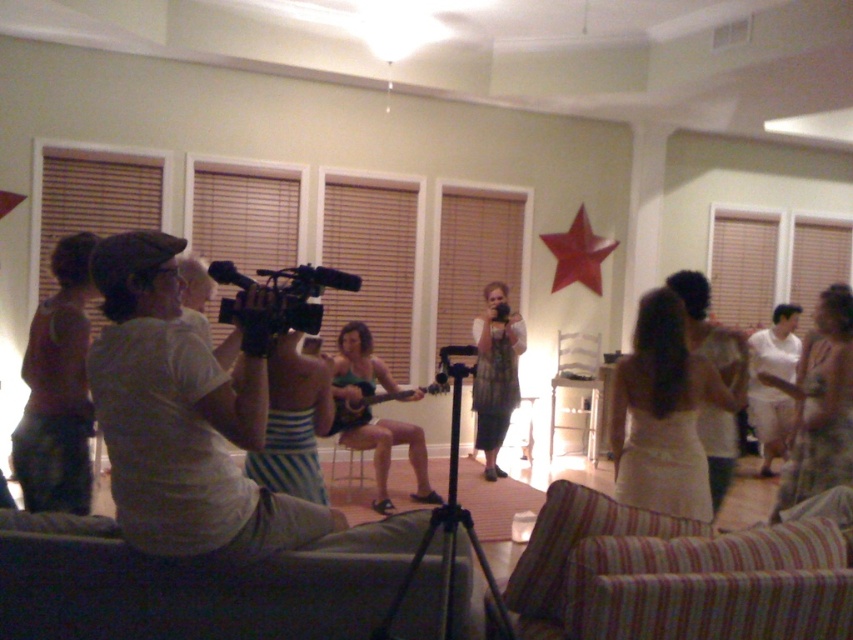
Question: Does white lace dress at center appear on the right side of matte brown shirt at left?

Choices:
 (A) yes
 (B) no

Answer: (A)

Question: Is patterned fabric dress at center in front of black plastic video camera at center?

Choices:
 (A) yes
 (B) no

Answer: (B)

Question: Which of these objects is positioned closest to the black metal tripod at center?

Choices:
 (A) black plastic video camera at center
 (B) metallic silver dress at center
 (C) patterned fabric dress at center
 (D) glossy red star at center

Answer: (A)

Question: Can you confirm if black plastic video camera at center is smaller than glossy red star at center?

Choices:
 (A) no
 (B) yes

Answer: (B)

Question: Which object is farther from the camera taking this photo?

Choices:
 (A) patterned fabric dress at center
 (B) metallic silver dress at center

Answer: (B)

Question: Which object appears farthest from the camera in this image?

Choices:
 (A) patterned fabric dress at center
 (B) white lace dress at center
 (C) green fabric dress at center

Answer: (C)